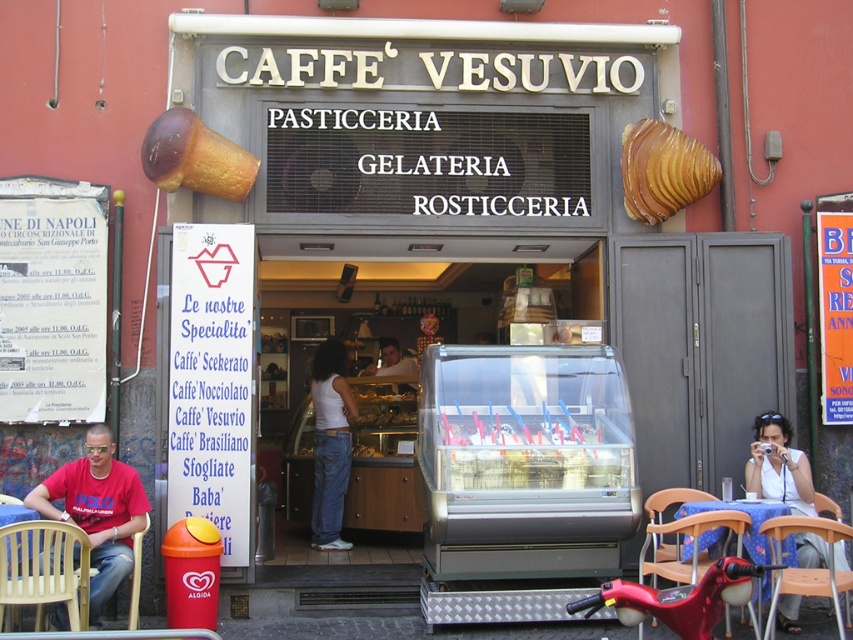
You are a customer waiting to sit down at Caff? Vesuvio. You see a plastic yellow chair at lower left and a wooden chair at lower left. Which chair is closer to the entrance?

The plastic yellow chair at lower left is positioned on the left side of wooden chair at lower left, so the plastic yellow chair at lower left is closer to the entrance.